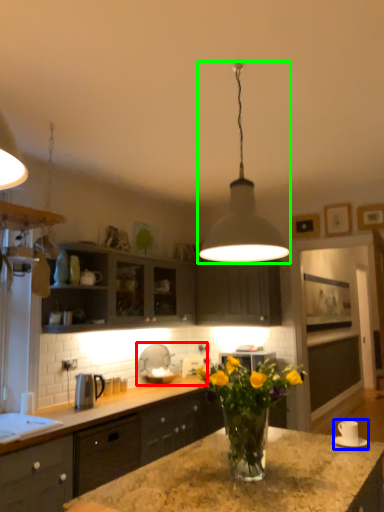
Question: Which object is positioned closest to sink (highlighted by a red box)? Select from appliance (highlighted by a blue box) and lamp (highlighted by a green box).

Choices:
 (A) appliance
 (B) lamp

Answer: (A)